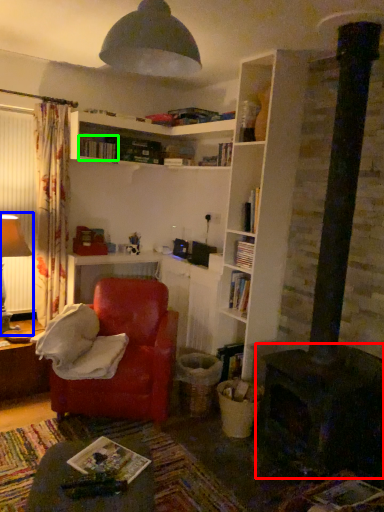
Question: Based on their relative distances, which object is farther from fireplace (highlighted by a red box)? Choose from table lamp (highlighted by a blue box) and book (highlighted by a green box).

Choices:
 (A) table lamp
 (B) book

Answer: (B)